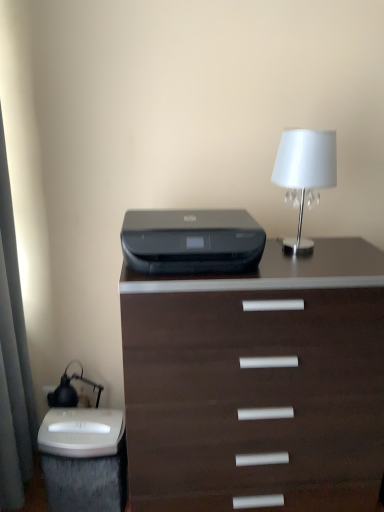
This screenshot has width=384, height=512. Find the location of `vacant point to the right of white glossy lampshade at upper right`. vacant point to the right of white glossy lampshade at upper right is located at coordinates (350, 252).